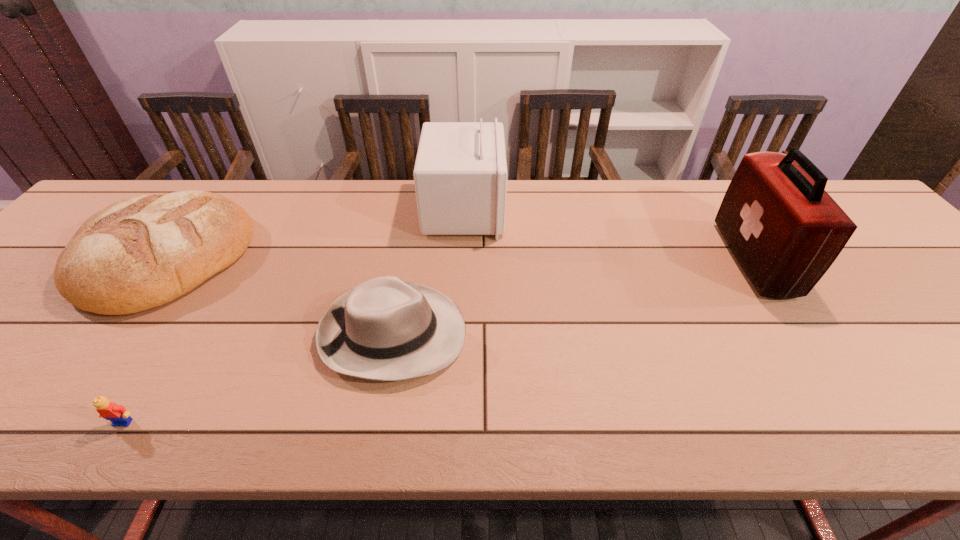
Find the location of a particular element. the right first-aid kit is located at coordinates (785, 231).

This screenshot has height=540, width=960. In order to click on the left first-aid kit in this screenshot , I will do `click(460, 175)`.

The height and width of the screenshot is (540, 960). Find the location of `bread`. bread is located at coordinates (139, 253).

The width and height of the screenshot is (960, 540). I want to click on fedora, so 385,329.

Identify the location of Lego. This screenshot has height=540, width=960. (117, 414).

Where is `the shortest object`? the shortest object is located at coordinates (117, 414).

Locate an element on the screen. The image size is (960, 540). free location located 0.090m on the side of the rightmost object with the cross symbol is located at coordinates (695, 259).

I want to click on free region located 0.260m on the side of the rightmost object with the cross symbol, so click(x=629, y=259).

Image resolution: width=960 pixels, height=540 pixels. What are the coordinates of `free space located 0.060m on the side of the rightmost object with the cross symbol` in the screenshot? It's located at (708, 259).

Identify the location of free space located on the front-facing side of the left first-aid kit. (523, 210).